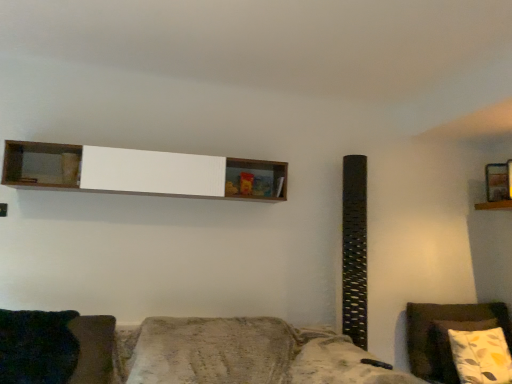
Question: Is dark green fabric pillow at lower left facing towards floral pillow at right?

Choices:
 (A) yes
 (B) no

Answer: (B)

Question: Considering the relative sizes of dark green fabric pillow at lower left and floral pillow at right in the image provided, is dark green fabric pillow at lower left taller than floral pillow at right?

Choices:
 (A) no
 (B) yes

Answer: (A)

Question: Would you say floral pillow at right is part of dark green fabric pillow at lower left's contents?

Choices:
 (A) yes
 (B) no

Answer: (B)

Question: Is the surface of dark green fabric pillow at lower left in direct contact with floral pillow at right?

Choices:
 (A) no
 (B) yes

Answer: (A)

Question: From the image's perspective, does dark green fabric pillow at lower left appear lower than floral pillow at right?

Choices:
 (A) no
 (B) yes

Answer: (A)

Question: Looking at the image, does wooden shelf at upper right, the 2th shelf viewed from the left, seem bigger or smaller compared to dark green fabric pillow at lower left?

Choices:
 (A) big
 (B) small

Answer: (B)

Question: From the image's perspective, is wooden shelf at upper right, marked as the 1th shelf in a back-to-front arrangement, above or below dark green fabric pillow at lower left?

Choices:
 (A) above
 (B) below

Answer: (A)

Question: Choose the correct answer: Is wooden shelf at upper right, acting as the 1th shelf starting from the right, inside dark green fabric pillow at lower left or outside it?

Choices:
 (A) outside
 (B) inside

Answer: (A)

Question: Based on their positions, is wooden shelf at upper right, the 2th shelf viewed from the left, located to the left or right of dark green fabric pillow at lower left?

Choices:
 (A) left
 (B) right

Answer: (B)

Question: From a real-world perspective, is textured brown fabric couch at lower center above or below white wood shelf at upper center, which ranks as the 1th shelf in left-to-right order?

Choices:
 (A) below
 (B) above

Answer: (A)

Question: From the image's perspective, is textured brown fabric couch at lower center located above or below white wood shelf at upper center, which appears as the second shelf when viewed from the right?

Choices:
 (A) below
 (B) above

Answer: (A)

Question: Considering the positions of textured brown fabric couch at lower center and white wood shelf at upper center, which appears as the second shelf when viewed from the right, in the image, is textured brown fabric couch at lower center taller or shorter than white wood shelf at upper center, which appears as the second shelf when viewed from the right,?

Choices:
 (A) tall
 (B) short

Answer: (A)

Question: Is textured brown fabric couch at lower center situated inside white wood shelf at upper center, which ranks as the 1th shelf in left-to-right order, or outside?

Choices:
 (A) inside
 (B) outside

Answer: (B)

Question: Is textured brown fabric couch at lower center situated inside dark green fabric pillow at lower left or outside?

Choices:
 (A) inside
 (B) outside

Answer: (B)

Question: From a real-world perspective, is textured brown fabric couch at lower center physically located above or below dark green fabric pillow at lower left?

Choices:
 (A) above
 (B) below

Answer: (B)